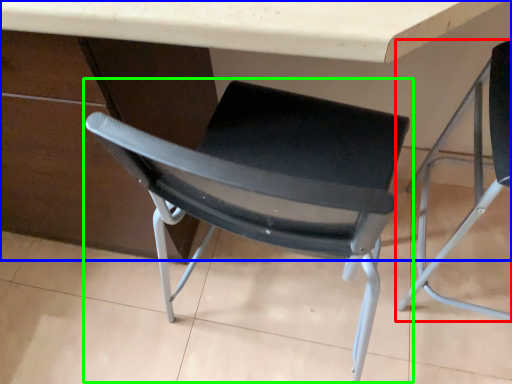
Question: Which is farther away from chair (highlighted by a red box)? table (highlighted by a blue box) or chair (highlighted by a green box)?

Choices:
 (A) table
 (B) chair

Answer: (B)